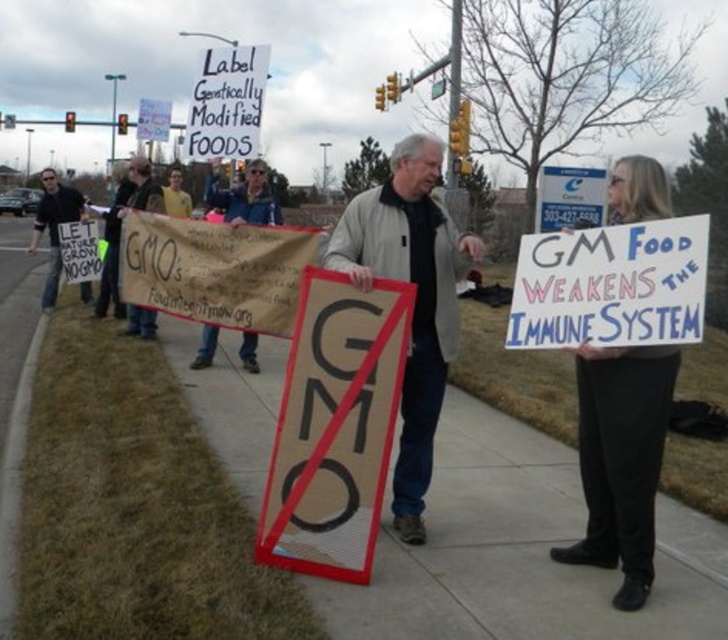
You are a photographer taking a picture of the protest. You notice two points in the scene at coordinates point (258, 97) and point (438, 93). Which point is closer to your camera lens?

Point (258, 97) is closer to the camera lens than point (438, 93).

You are a photographer standing at the intersection. You want to take a photo that includes both the white paper sign at upper center and the metallic street sign at upper center. The camera you are using has a maximum focus range of 10 meters. Will you be able to capture both signs in focus at the same time?

The white paper sign at upper center is 10.02 meters away from the metallic street sign at upper center. Since the distance between them exceeds the camera maximum focus range of 10 meters, you cannot capture both signs in focus simultaneously.